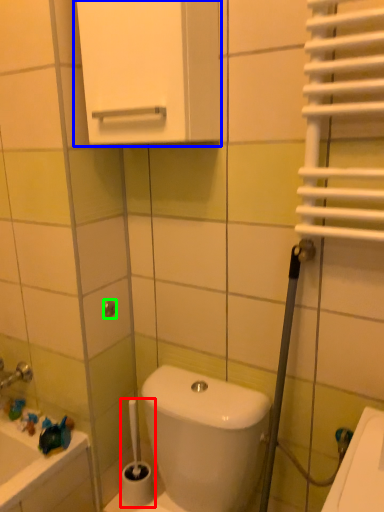
Question: Estimate the real-world distances between objects in this image. Which object is farther from brush (highlighted by a red box), medicine cabinet (highlighted by a blue box) or shower (highlighted by a green box)?

Choices:
 (A) medicine cabinet
 (B) shower

Answer: (A)